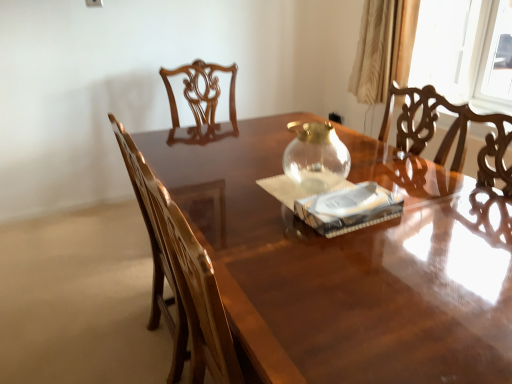
Question: Can you confirm if transparent glass teapot at center is thinner than beige satin curtain at upper right?

Choices:
 (A) no
 (B) yes

Answer: (B)

Question: Does transparent glass teapot at center appear on the right side of beige satin curtain at upper right?

Choices:
 (A) no
 (B) yes

Answer: (A)

Question: Considering the relative sizes of transparent glass teapot at center and beige satin curtain at upper right in the image provided, is transparent glass teapot at center shorter than beige satin curtain at upper right?

Choices:
 (A) yes
 (B) no

Answer: (A)

Question: Can we say transparent glass teapot at center lies outside beige satin curtain at upper right?

Choices:
 (A) yes
 (B) no

Answer: (A)

Question: Does transparent glass teapot at center have a larger size compared to beige satin curtain at upper right?

Choices:
 (A) no
 (B) yes

Answer: (A)

Question: Considering the positions of white paper at center and beige satin curtain at upper right in the image, is white paper at center wider or thinner than beige satin curtain at upper right?

Choices:
 (A) thin
 (B) wide

Answer: (B)

Question: In terms of height, does white paper at center look taller or shorter compared to beige satin curtain at upper right?

Choices:
 (A) tall
 (B) short

Answer: (B)

Question: Would you say white paper at center is inside or outside beige satin curtain at upper right?

Choices:
 (A) inside
 (B) outside

Answer: (B)

Question: Is point (331, 236) closer or farther from the camera than point (407, 41)?

Choices:
 (A) closer
 (B) farther

Answer: (A)

Question: From a real-world perspective, is glossy wood chair at left positioned above or below glossy wood table at center?

Choices:
 (A) below
 (B) above

Answer: (B)

Question: Is glossy wood chair at left bigger or smaller than glossy wood table at center?

Choices:
 (A) big
 (B) small

Answer: (B)

Question: In terms of height, does glossy wood chair at left look taller or shorter compared to glossy wood table at center?

Choices:
 (A) short
 (B) tall

Answer: (B)

Question: Is glossy wood chair at left inside or outside of glossy wood table at center?

Choices:
 (A) outside
 (B) inside

Answer: (A)

Question: From their relative heights in the image, would you say glossy wood table at center is taller or shorter than glossy wood chair at left?

Choices:
 (A) short
 (B) tall

Answer: (A)

Question: Considering the relative positions of glossy wood table at center and glossy wood chair at left in the image provided, is glossy wood table at center to the left or to the right of glossy wood chair at left?

Choices:
 (A) right
 (B) left

Answer: (A)